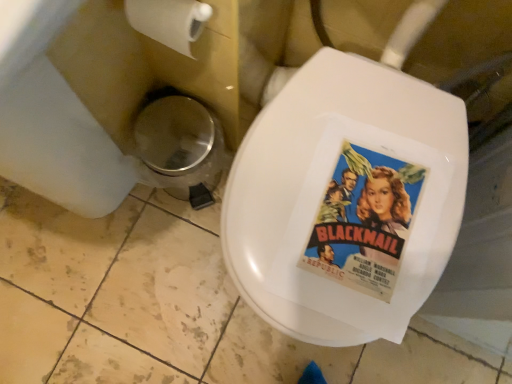
Question: Is metallic silver trash can at lower left far from white matte toilet paper at upper left?

Choices:
 (A) no
 (B) yes

Answer: (A)

Question: Does metallic silver trash can at lower left have a lesser width compared to white matte toilet paper at upper left?

Choices:
 (A) yes
 (B) no

Answer: (B)

Question: Is white matte toilet paper at upper left a part of metallic silver trash can at lower left?

Choices:
 (A) yes
 (B) no

Answer: (B)

Question: From a real-world perspective, is metallic silver trash can at lower left physically below white matte toilet paper at upper left?

Choices:
 (A) yes
 (B) no

Answer: (A)

Question: Is metallic silver trash can at lower left oriented towards white matte toilet paper at upper left?

Choices:
 (A) no
 (B) yes

Answer: (A)

Question: Based on their sizes in the image, would you say vintage paper movie poster at center is bigger or smaller than white matte toilet paper at upper left?

Choices:
 (A) small
 (B) big

Answer: (A)

Question: From a real-world perspective, is vintage paper movie poster at center physically located above or below white matte toilet paper at upper left?

Choices:
 (A) below
 (B) above

Answer: (A)

Question: From the image's perspective, is vintage paper movie poster at center above or below white matte toilet paper at upper left?

Choices:
 (A) above
 (B) below

Answer: (B)

Question: Is vintage paper movie poster at center in front of or behind white matte toilet paper at upper left in the image?

Choices:
 (A) behind
 (B) front

Answer: (A)

Question: Is point (141, 11) closer or farther from the camera than point (181, 198)?

Choices:
 (A) closer
 (B) farther

Answer: (A)

Question: In terms of size, does white matte toilet paper at upper left appear bigger or smaller than metallic silver trash can at lower left?

Choices:
 (A) big
 (B) small

Answer: (B)

Question: Choose the correct answer: Is white matte toilet paper at upper left inside metallic silver trash can at lower left or outside it?

Choices:
 (A) outside
 (B) inside

Answer: (A)

Question: Looking at their shapes, would you say white matte toilet paper at upper left is wider or thinner than metallic silver trash can at lower left?

Choices:
 (A) thin
 (B) wide

Answer: (A)

Question: Based on their positions, is metallic silver trash can at lower left located to the left or right of white matte toilet paper at upper left?

Choices:
 (A) right
 (B) left

Answer: (B)

Question: In terms of height, does metallic silver trash can at lower left look taller or shorter compared to white matte toilet paper at upper left?

Choices:
 (A) tall
 (B) short

Answer: (A)